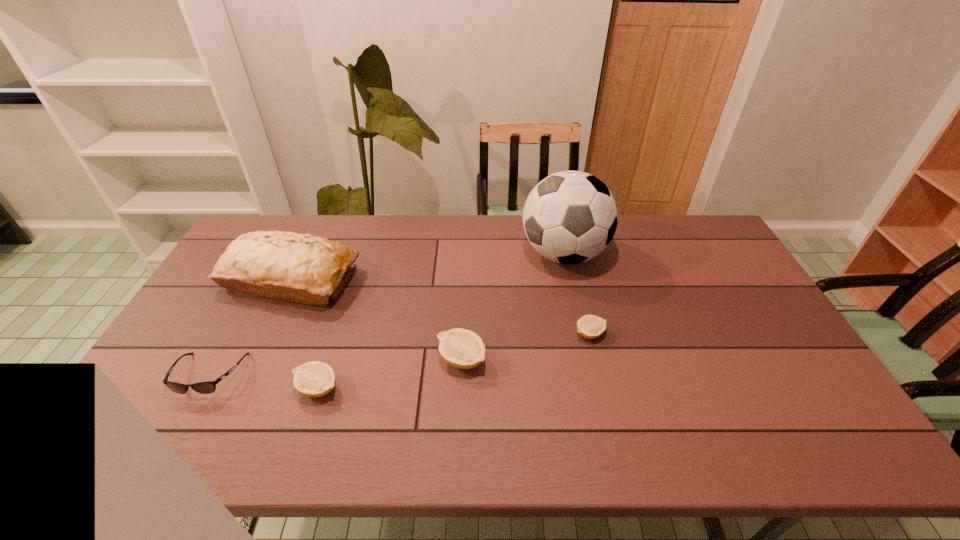
The image size is (960, 540). What are the coordinates of `empty space between the sunglasses and the tallest lemon` in the screenshot? It's located at (336, 367).

What are the coordinates of `vacant area that lies between the tallest object and the rightmost lemon` in the screenshot? It's located at (577, 294).

Find the location of a particular element. free point between the shortest object and the tallest lemon is located at coordinates (526, 347).

The image size is (960, 540). Identify the location of free spot between the sunglasses and the shortest lemon. (399, 354).

Where is `vacant space that's between the sunglasses and the fifth shortest object`? This screenshot has width=960, height=540. vacant space that's between the sunglasses and the fifth shortest object is located at coordinates (251, 327).

Locate an element on the screen. The width and height of the screenshot is (960, 540). free spot between the sunglasses and the fourth object from left to right is located at coordinates (336, 367).

Image resolution: width=960 pixels, height=540 pixels. I want to click on free area in between the second tallest object and the sunglasses, so (x=251, y=327).

This screenshot has width=960, height=540. What are the coordinates of `the fifth closest object relative to the sunglasses` in the screenshot? It's located at [x=589, y=326].

Identify which object is the second closest to the shortest object. Please provide its 2D coordinates. Your answer should be formatted as a tuple, i.e. [(x, y)], where the tuple contains the x and y coordinates of a point satisfying the conditions above.

[(461, 348)]

What are the coordinates of `lemon that is the closest to the second tallest lemon` in the screenshot? It's located at (461, 348).